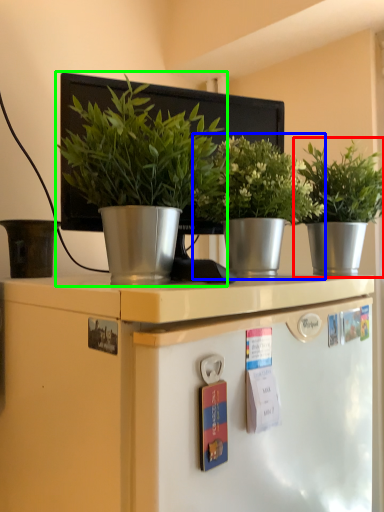
Question: Estimate the real-world distances between objects in this image. Which object is closer to houseplant (highlighted by a red box), houseplant (highlighted by a blue box) or houseplant (highlighted by a green box)?

Choices:
 (A) houseplant
 (B) houseplant

Answer: (A)